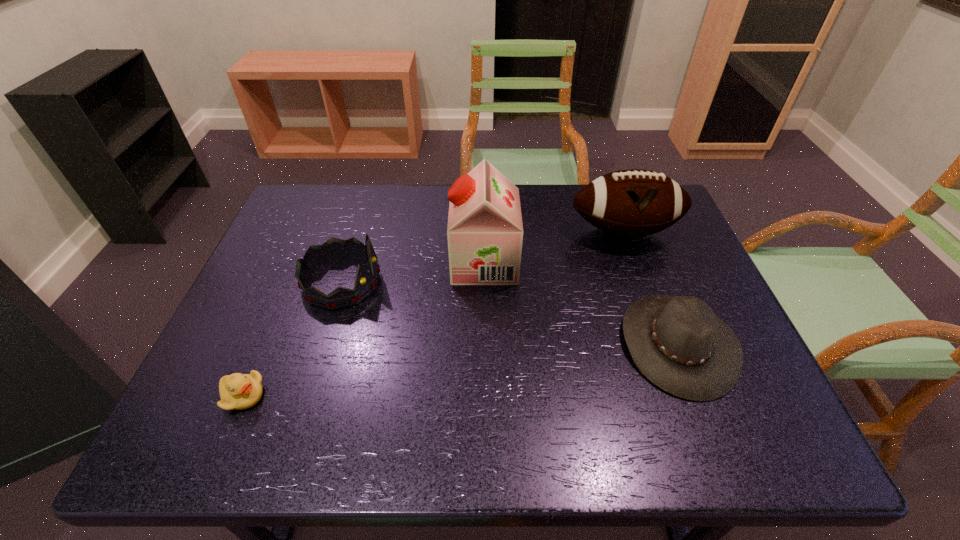
At what (x,y) coordinates should I click in order to perform the action: click on vacant space that's between the hat and the shortest object. Please return your answer as a coordinate pair (x, y). Looking at the image, I should click on (461, 370).

The image size is (960, 540). What are the coordinates of `empty location between the tiara and the duckling` in the screenshot? It's located at (293, 339).

Find the location of a particular element. This screenshot has width=960, height=540. vacant region between the duckling and the soya milk is located at coordinates (x=364, y=329).

At what (x,y) coordinates should I click in order to perform the action: click on empty space between the tiara and the hat. Please return your answer as a coordinate pair (x, y). Image resolution: width=960 pixels, height=540 pixels. Looking at the image, I should click on (510, 313).

Locate an element on the screen. This screenshot has width=960, height=540. object that is the third closest to the shortest object is located at coordinates (678, 343).

Identify the location of object identified as the third closest to the fourth shortest object. (333, 249).